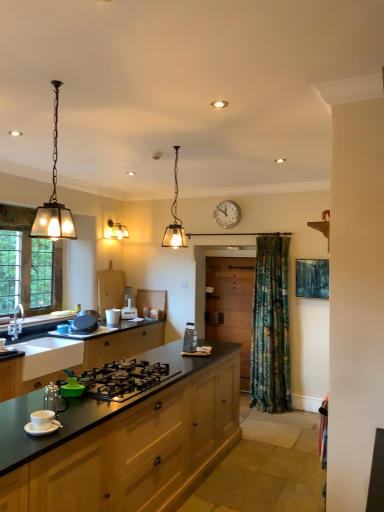
What are the coordinates of `free space that is to the left of metallic silver tea pot at lower left` in the screenshot? It's located at (20, 415).